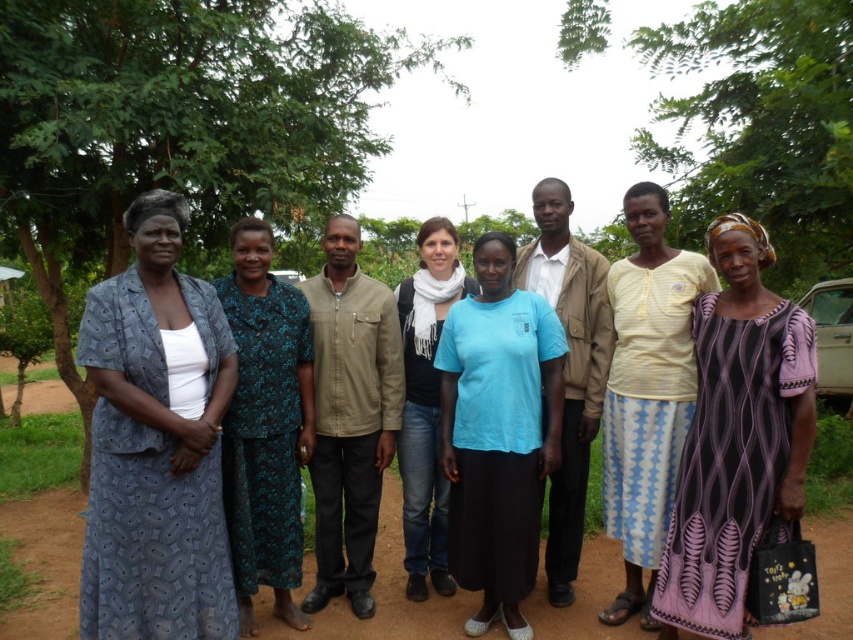
Does green leafy tree at center have a smaller size compared to printed fabric dress at left?

Incorrect, green leafy tree at center is not smaller in size than printed fabric dress at left.

Is green leafy tree at center below printed fabric dress at left?

Incorrect, green leafy tree at center is not positioned below printed fabric dress at left.

Describe the element at coordinates (761, 125) in the screenshot. The width and height of the screenshot is (853, 640). I see `green leafy tree at center` at that location.

This screenshot has width=853, height=640. In order to click on green leafy tree at center in this screenshot , I will do `click(761, 125)`.

Who is taller, green leafy tree at center or khaki cotton jacket at center?

With more height is green leafy tree at center.

Is green leafy tree at center to the left of khaki cotton jacket at center from the viewer's perspective?

No, green leafy tree at center is not to the left of khaki cotton jacket at center.

Is point (792, 52) closer to camera compared to point (358, 422)?

That is False.

I want to click on green leafy tree at center, so click(761, 125).

Who is more distant from viewer, (x=173, y=240) or (x=770, y=429)?

Point (x=770, y=429)

Can you confirm if printed fabric dress at left is thinner than purple woven dress at center?

No, printed fabric dress at left is not thinner than purple woven dress at center.

Identify the location of printed fabric dress at left. The height and width of the screenshot is (640, 853). (x=169, y=344).